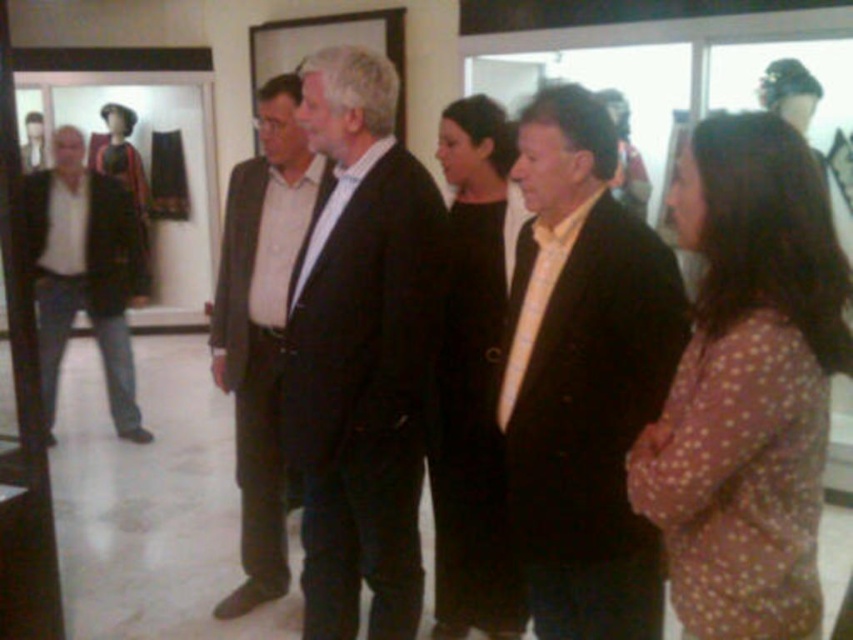
You are an event planner arranging a photoshoot in the gallery. You need to position the brown dotted dress at lower right and the matte black suit at center so that the dress is on the right side of the suit. Is this arrangement possible given their current positions?

Yes, the arrangement is possible because the brown dotted dress at lower right is already positioned on the right side of the matte black suit at center.